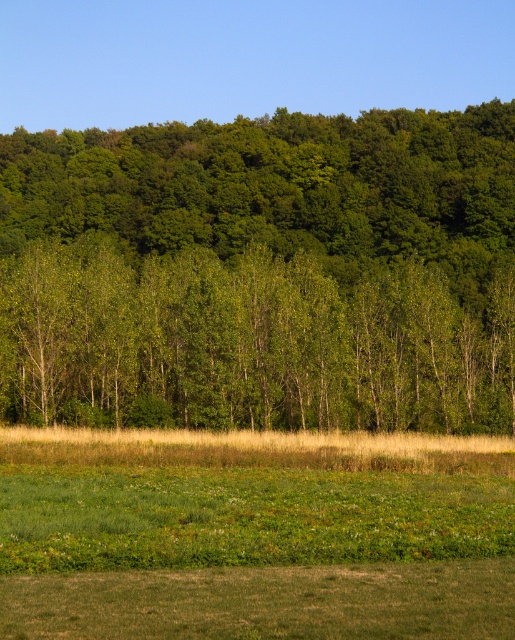
You are standing in the middle of the green grassy field at lower center and want to reach the green leafy trees at upper center. Which direction should you walk to get closer to the trees?

The green leafy trees at upper center are taller than the green grassy field at lower center. To reach them, you should walk upwards towards the upper part of the field.

You are standing at a point in a grassy field with trees in the middle ground. You want to walk to a specific location marked by point [168,216]. How far will you have to walk to reach that point?

The distance between point [168,216] and the viewer is 142.42 meters, so you will have to walk 142.42 meters to reach that point.